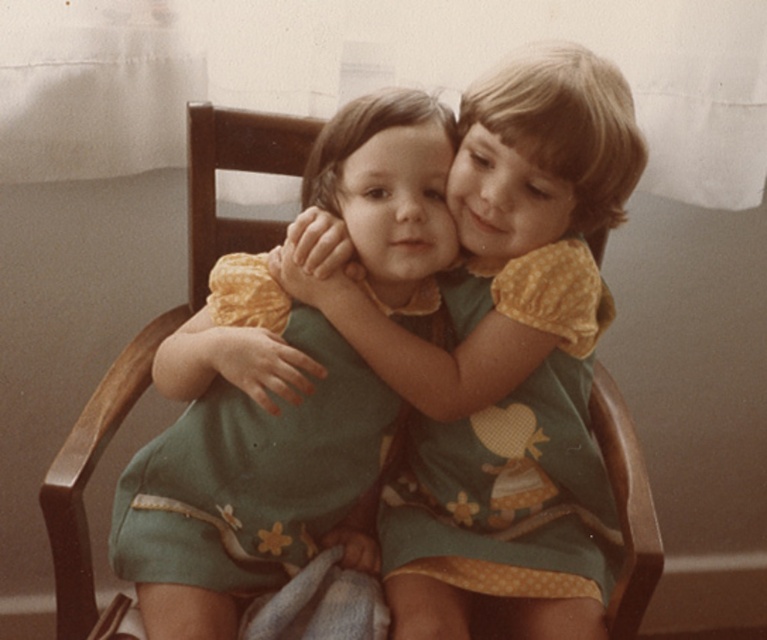
You are a photographer trying to capture a closeup of the point at coordinates point [196,579]. The camera has a focal length of 50mm and a sensor size of 24x36mm. What is the minimum distance you need to move the camera forward to ensure the point fills the frame vertically?

The point at coordinates point [196,579] is 37.08 inches from the camera. To calculate the minimum distance needed, use the formula for field of view. The vertical field of view at 50mm is approximately 27 degrees. Using trigonometry, the required distance would be the height divided by tan fov. However, since the point is a single point, it has no dimension, so it cannot fill the frame. Therefore, the question is theoretical, but based on the given data, the point is already 37.08 inches away.

You are taking a photo of two children sitting on a wooden chair. You notice two points marked in the image. The first point is at coordinates point (394, 259) and the second point is at point (482, 513). Which point is closer to the camera?

Point (394, 259) is closer to the camera than point (482, 513).

You are standing in front of a painting that depicts two children sitting on a wooden chair, each wearing green dresses with floral patterns. There is a specific point marked at coordinates point (x=570, y=476). If you want to touch this point with your hand, which direction should you move your hand relative to the wooden chair in the painting?

The point (x=570, y=476) is 1.06 meters away from you, so you would need to extend your hand forward towards the wooden chair in the painting to reach it.